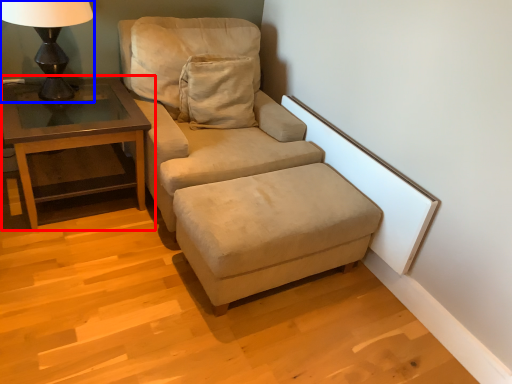
Question: Which object appears closest to the camera in this image, table (highlighted by a red box) or table lamp (highlighted by a blue box)?

Choices:
 (A) table
 (B) table lamp

Answer: (B)